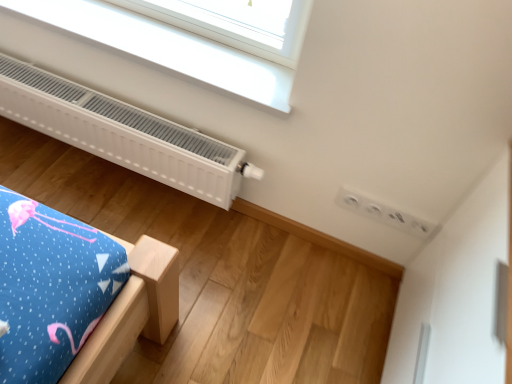
Find the location of a particular element. The height and width of the screenshot is (384, 512). free point above white plastic window at upper center (from a real-world perspective) is located at coordinates (161, 38).